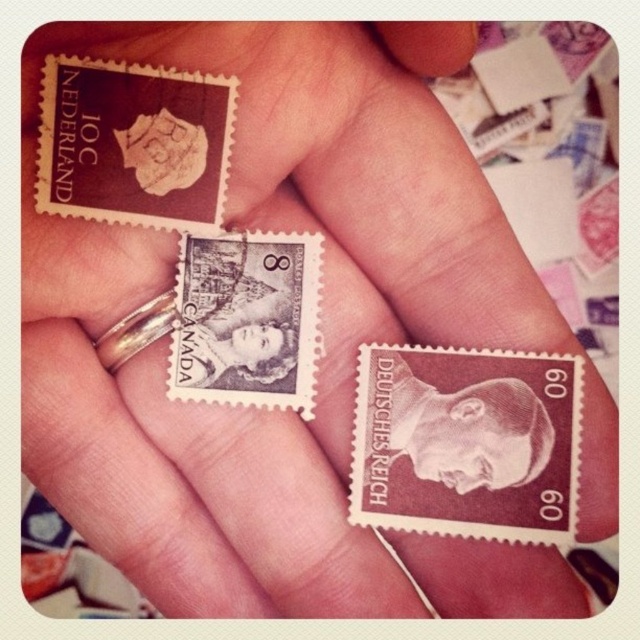
Looking at the stamps in the hand, can you tell me which position the brown paper stamp at center is relative to the brown paper stamp at upper left?

The brown paper stamp at center is to the right of the brown paper stamp at upper left.

You are organizing a stamp collection and notice two stamps on your desk. The first is the brown paper stamp at upper left, and the second is the smooth brown portrait at center. According to the image, which stamp is placed above the other?

The brown paper stamp at upper left is positioned over smooth brown portrait at center, so it is placed above the smooth brown portrait at center.

You are organizing a stamp collection and need to place the brown paper stamp at upper left and the smooth brown portrait at center into an album. The album has two slots side by side with the left slot being narrower than the right. Which stamp should go into which slot to fit properly?

The brown paper stamp at upper left should go into the right slot and the smooth brown portrait at center into the left slot because the brown paper stamp at upper left is wider than the smooth brown portrait at center, so it needs the wider right slot while the narrower left slot accommodates the smaller smooth brown portrait at center.